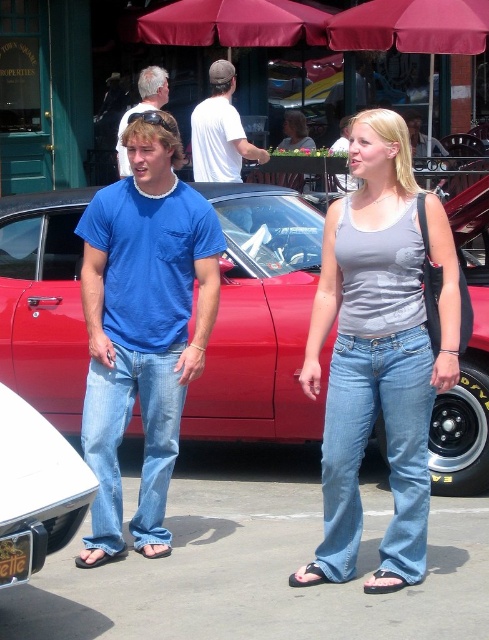
Between point (162, 337) and point (159, 360), which one is positioned behind?

Point (162, 337)

Measure the distance between point (153, 554) and camera.

A distance of 4.52 meters exists between point (153, 554) and camera.

Is point (205, 221) closer to camera compared to point (155, 500)?

That is True.

At what (x,y) coordinates should I click in order to perform the action: click on blue cotton t-shirt at center. Please return your answer as a coordinate pair (x, y). Looking at the image, I should click on (142, 326).

Is blue denim jeans at center positioned at the back of metallic silver bumper at lower left?

Yes, it is behind metallic silver bumper at lower left.

Consider the image. Which of these two, blue denim jeans at center or metallic silver bumper at lower left, stands taller?

blue denim jeans at center

In order to click on blue denim jeans at center in this screenshot , I will do `click(121, 438)`.

Does blue cotton t-shirt at center appear under denim jeans at center?

No, blue cotton t-shirt at center is not below denim jeans at center.

Does point (142, 424) come closer to viewer compared to point (347, 404)?

No, it is behind (347, 404).

Does point (120, 214) lie in front of point (353, 513)?

No.

Find the location of `blue cotton t-shirt at center`. blue cotton t-shirt at center is located at coordinates [142, 326].